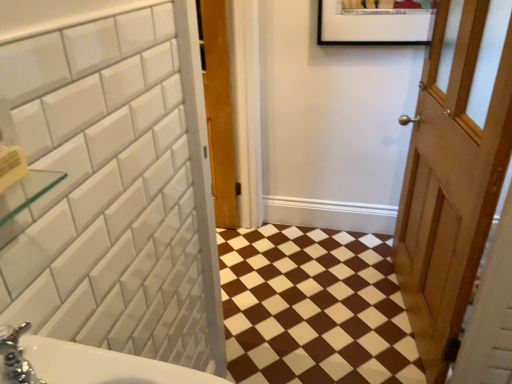
You are a GUI agent. You are given a task and a screenshot of the screen. Output one action in this format:
    pyautogui.click(x=<x>, y=<y>)
    Task: Click on the blank space to the left of wooden door at right
    Image resolution: width=512 pixels, height=384 pixels.
    Given the screenshot: What is the action you would take?
    pyautogui.click(x=331, y=307)